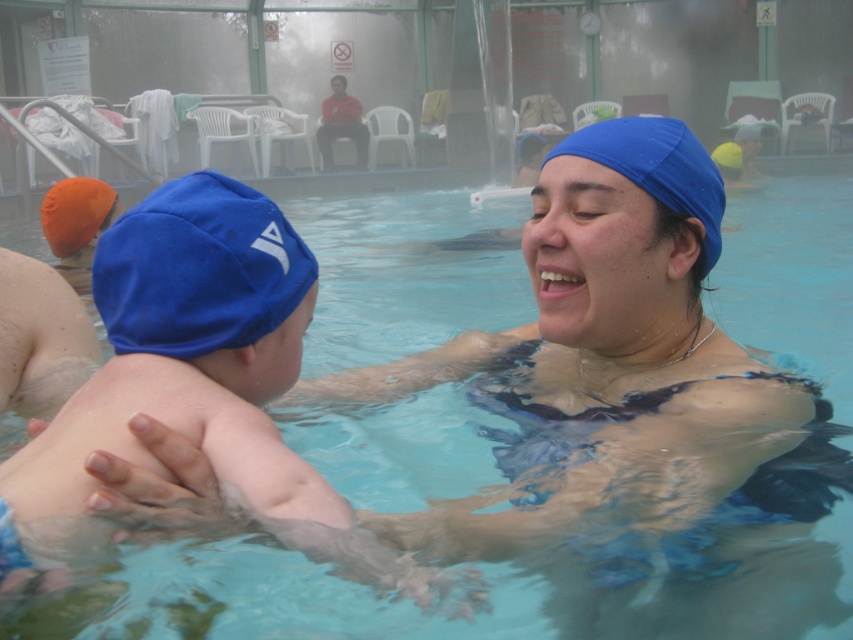
Question: Is blue fleece swim cap at left wider than blue fabric swim cap at center?

Choices:
 (A) no
 (B) yes

Answer: (A)

Question: Among these objects, which one is farthest from the camera?

Choices:
 (A) blue fabric swim cap at center
 (B) blue fleece swim cap at left

Answer: (A)

Question: Is blue fleece swim cap at left below blue fabric swim cap at center?

Choices:
 (A) yes
 (B) no

Answer: (A)

Question: Which of the following is the closest to the observer?

Choices:
 (A) (102, 273)
 (B) (579, 145)

Answer: (A)

Question: Is blue fleece swim cap at left positioned behind blue fabric swim cap at center?

Choices:
 (A) no
 (B) yes

Answer: (A)

Question: Which point is closer to the camera?

Choices:
 (A) (231, 285)
 (B) (708, 173)

Answer: (A)